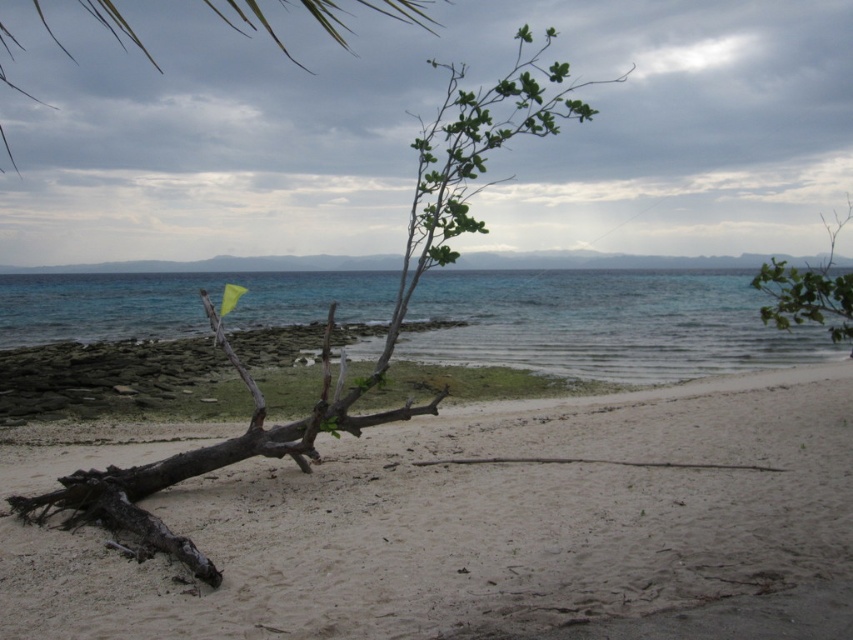
Does point (294, 289) come farther from viewer compared to point (827, 330)?

Yes, it is.

Who is lower down, clear blue water at center or green leafy branch at upper right?

Positioned lower is clear blue water at center.

Locate an element on the screen. This screenshot has height=640, width=853. clear blue water at center is located at coordinates (606, 323).

Where is `clear blue water at center`? clear blue water at center is located at coordinates (606, 323).

Does green leafy branch at upper center have a smaller size compared to green leafy branch at upper right?

Incorrect, green leafy branch at upper center is not smaller in size than green leafy branch at upper right.

Does point (16, 44) come behind point (759, 289)?

Yes, point (16, 44) is behind point (759, 289).

Identify the location of green leafy branch at upper center. (317, 17).

Is clear blue water at center thinner than green leafy branch at upper center?

Yes.

Can you confirm if clear blue water at center is positioned above green leafy branch at upper center?

No, clear blue water at center is not above green leafy branch at upper center.

Which is behind, point (85, 289) or point (6, 141)?

Point (85, 289)

Locate an element on the screen. clear blue water at center is located at coordinates (606, 323).